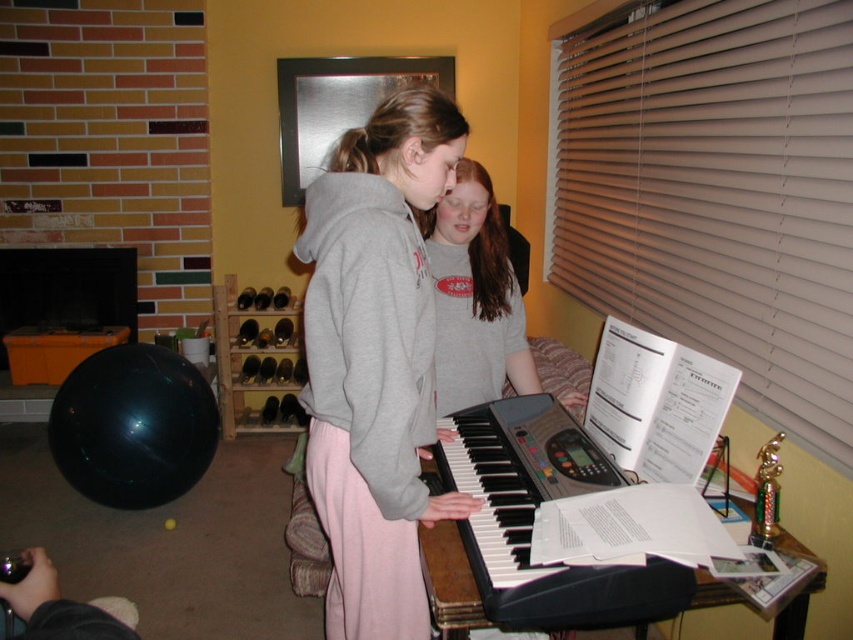
You are a photographer setting up a shoot in this living room. You need to position a light source above the black plastic keyboard at center so it illuminates the gray cotton shirt at center. Can you place the light directly above the keyboard to achieve this?

The black plastic keyboard at center is below gray cotton shirt at center, so placing the light directly above the keyboard would also shine light towards the gray cotton shirt at center, making it effective for illuminating the shirt.

You are a photographer setting up for a family photo in the living room. You need to position the black plastic keyboard at center so that it is to the right of the gray cotton shirt at center. Is the current arrangement correct?

Yes, the current arrangement is correct because the black plastic keyboard at center is positioned on the right side of the gray cotton shirt at center as required.

You are standing at the point labeled as point [473,515] in the living room. You want to walk to the fireplace located on the left side of the room. Is the point labeled as point [741,180] behind you or in front of you as you face the fireplace?

The point labeled as point [741,180] is behind point [473,515], so if you are facing the fireplace which is on the left side of the room, the point [741,180] would be behind you.